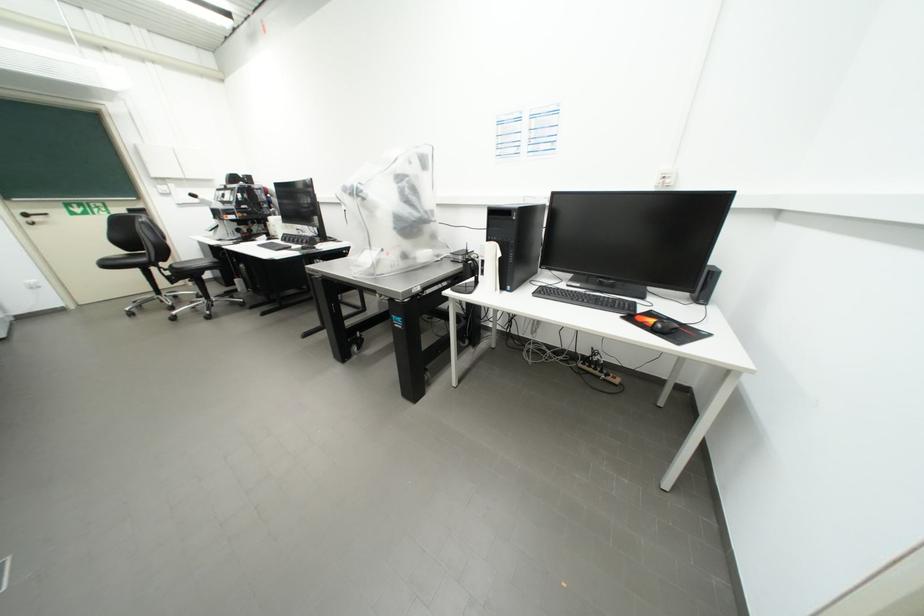
Image resolution: width=924 pixels, height=616 pixels. Describe the element at coordinates (132, 257) in the screenshot. I see `a chair sitting surface` at that location.